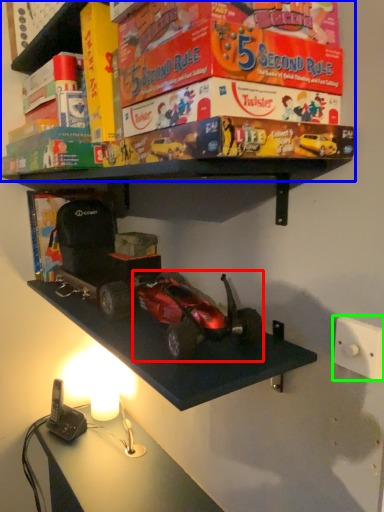
Question: Which is farther away from model car (highlighted by a red box)? shelf (highlighted by a blue box) or light switch (highlighted by a green box)?

Choices:
 (A) shelf
 (B) light switch

Answer: (A)